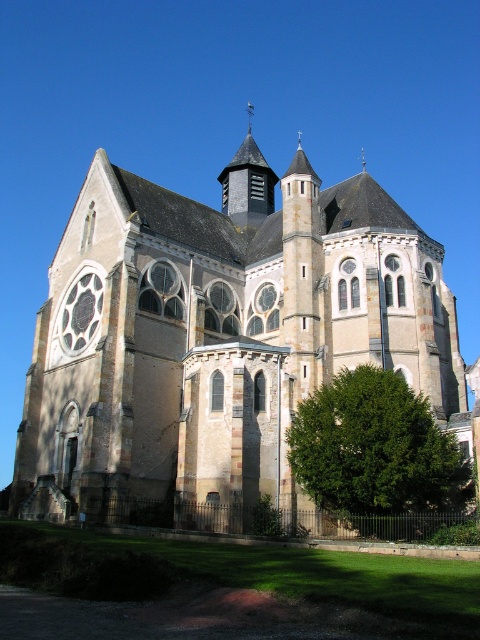
You are an architect visiting the church and want to compare the sizes of the stone church at center and the green leafy tree at lower right. Which one has a greater width?

The stone church at center has a greater width than the green leafy tree at lower right.

In the scene shown: You are standing in front of the stone church at center and looking towards the green leafy tree at lower right. Which object is taller?

The stone church at center is much taller than the green leafy tree at lower right.

You are standing at the point with coordinates point (x=218, y=333). Based on the scene described, what structure are you directly facing?

The point (x=218, y=333) corresponds to the stone church at center, so you are directly facing the stone church at center.